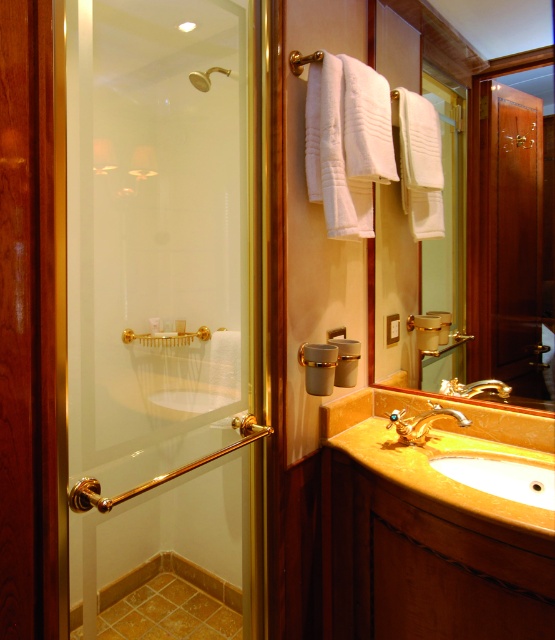
Question: Considering the relative positions of matte gold mirror at center and matte gold showerhead at upper left in the image provided, where is matte gold mirror at center located with respect to matte gold showerhead at upper left?

Choices:
 (A) left
 (B) right

Answer: (B)

Question: Which object is the closest to the gold metallic faucet at sink right?

Choices:
 (A) gold metallic faucet at center
 (B) yellow marble sink at lower center

Answer: (A)

Question: Which point is farther to the camera?

Choices:
 (A) (481, 177)
 (B) (231, 604)
 (C) (466, 390)
 (D) (441, 412)

Answer: (B)

Question: Where is clear glass shower door at left located in relation to gold metallic faucet at sink right in the image?

Choices:
 (A) above
 (B) below

Answer: (A)

Question: Does gold metallic faucet at center have a greater width compared to matte gold showerhead at upper left?

Choices:
 (A) no
 (B) yes

Answer: (A)

Question: Which is farther from the gold metallic faucet at center?

Choices:
 (A) yellow marble sink at lower center
 (B) matte gold showerhead at upper left
 (C) gold metallic faucet at sink right

Answer: (B)